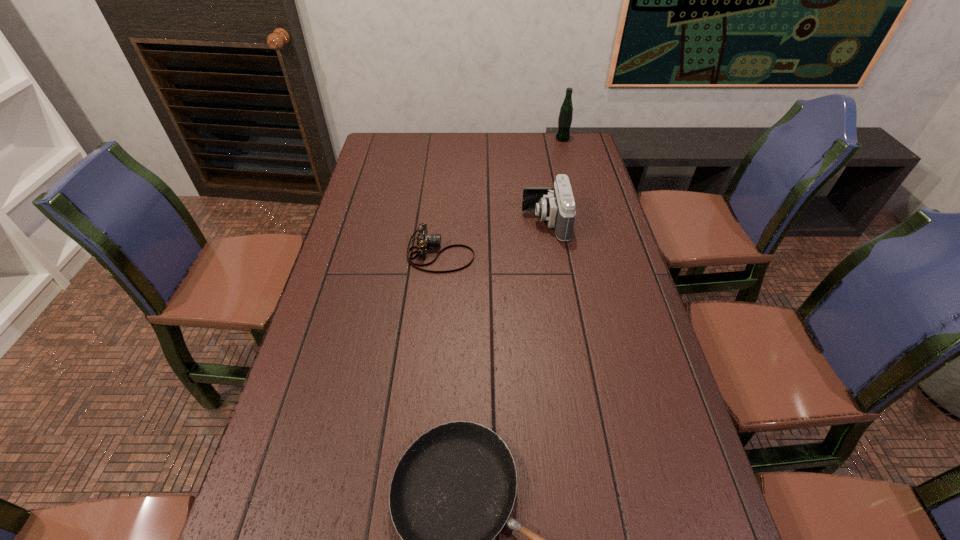
The image size is (960, 540). In order to click on free point between the second tallest object and the farthest object in this screenshot , I will do `click(554, 181)`.

The height and width of the screenshot is (540, 960). Identify the location of vacant area that lies between the shorter camera and the rightmost object. (501, 196).

At what (x,y) coordinates should I click in order to perform the action: click on vacant area that lies between the second shortest object and the right camera. Please return your answer as a coordinate pair (x, y). Looking at the image, I should click on (493, 238).

Where is `empty location between the third tallest object and the rightmost object`? empty location between the third tallest object and the rightmost object is located at coordinates (501, 196).

Find the location of a particular element. This screenshot has height=540, width=960. free space that is in between the third tallest object and the tallest object is located at coordinates pos(501,196).

Where is `the third closest object to the shorter camera`? The height and width of the screenshot is (540, 960). the third closest object to the shorter camera is located at coordinates (566, 111).

At what (x,y) coordinates should I click in order to perform the action: click on object that is the third closest to the beer bottle. Please return your answer as a coordinate pair (x, y). This screenshot has width=960, height=540. Looking at the image, I should click on (453, 490).

In order to click on blank area in the image that satisfies the following two spatial constraints: 1. on the front side of the rightmost object; 2. on the front-facing side of the second shortest object in this screenshot , I will do `click(592, 254)`.